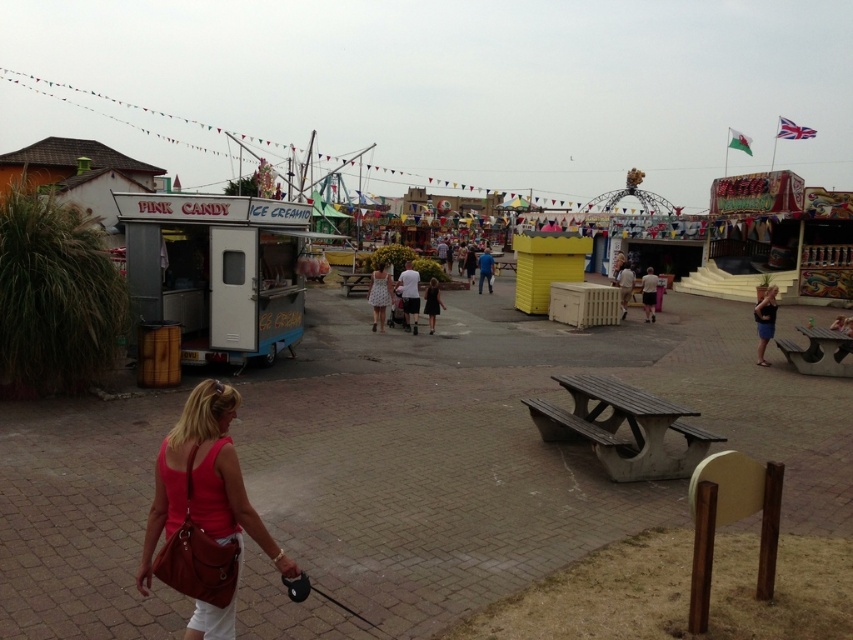
Does wooden picnic table at center appear on the right side of dark blue jeans at lower right?

In fact, wooden picnic table at center is to the left of dark blue jeans at lower right.

Can you confirm if wooden picnic table at center is bigger than dark blue jeans at lower right?

Actually, wooden picnic table at center might be smaller than dark blue jeans at lower right.

Is point (685, 433) positioned in front of point (767, 326)?

That is True.

Locate an element on the screen. wooden picnic table at center is located at coordinates (618, 426).

Image resolution: width=853 pixels, height=640 pixels. What do you see at coordinates (202, 515) in the screenshot?
I see `matte brown purse at lower left` at bounding box center [202, 515].

Can you confirm if matte brown purse at lower left is positioned below blue fabric shirt at center?

Yes, matte brown purse at lower left is below blue fabric shirt at center.

At what (x,y) coordinates should I click in order to perform the action: click on matte brown purse at lower left. Please return your answer as a coordinate pair (x, y). Looking at the image, I should click on (202, 515).

Can you confirm if wooden picnic table at center is smaller than black matte dress at center?

Correct, wooden picnic table at center occupies less space than black matte dress at center.

Is wooden picnic table at center thinner than black matte dress at center?

In fact, wooden picnic table at center might be wider than black matte dress at center.

Does point (706, 444) lie behind point (437, 289)?

No, (706, 444) is closer to viewer.

Identify the location of wooden picnic table at center. The image size is (853, 640). (618, 426).